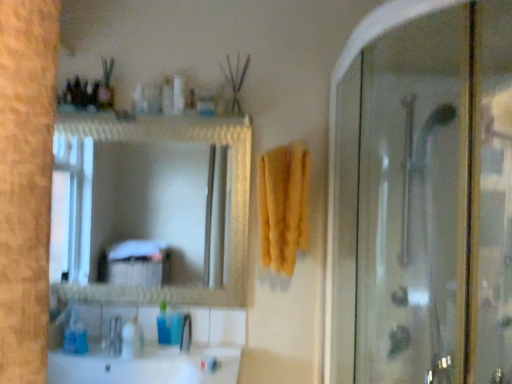
Question: From the image's perspective, is translucent plastic bottle at upper center, the 3th toiletry when ordered from left to right, located above or below blue plastic cup at lower center, the fourth toiletry in the top-to-bottom sequence?

Choices:
 (A) below
 (B) above

Answer: (B)

Question: Considering the positions of translucent plastic bottle at upper center, which is the 4th toiletry in bottom-to-top order, and blue plastic cup at lower center, which is counted as the first toiletry, starting from the right, in the image, is translucent plastic bottle at upper center, which is the 4th toiletry in bottom-to-top order, wider or thinner than blue plastic cup at lower center, which is counted as the first toiletry, starting from the right,?

Choices:
 (A) thin
 (B) wide

Answer: (B)

Question: Which of these objects is positioned closest to the translucent plastic bottle at upper center, placed as the 1th toiletry when sorted from top to bottom?

Choices:
 (A) white glossy sink at lower left
 (B) yellow soft towel at center
 (C) blue plastic bottle at lower center, which is the 2th toiletry from top to bottom
 (D) transparent glass shower door at right
 (E) translucent plastic soap dispenser at lower left, which ranks as the 4th toiletry in right-to-left order

Answer: (B)

Question: Estimate the real-world distances between objects in this image. Which object is closer to the white glossy sink at lower left?

Choices:
 (A) brushed metal faucet at lower center
 (B) yellow soft towel at center
 (C) translucent plastic bottle at upper center, placed as the 1th toiletry when sorted from top to bottom
 (D) blue plastic cup at lower center, which is counted as the first toiletry, starting from the right
 (E) translucent plastic soap dispenser at lower left, the 3th toiletry viewed from the top

Answer: (E)